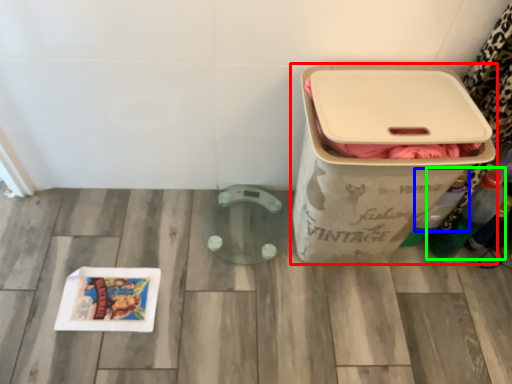
Question: Which is nearer to the waste container (highlighted by a red box)? bottle (highlighted by a blue box) or bottle (highlighted by a green box).

Choices:
 (A) bottle
 (B) bottle

Answer: (A)